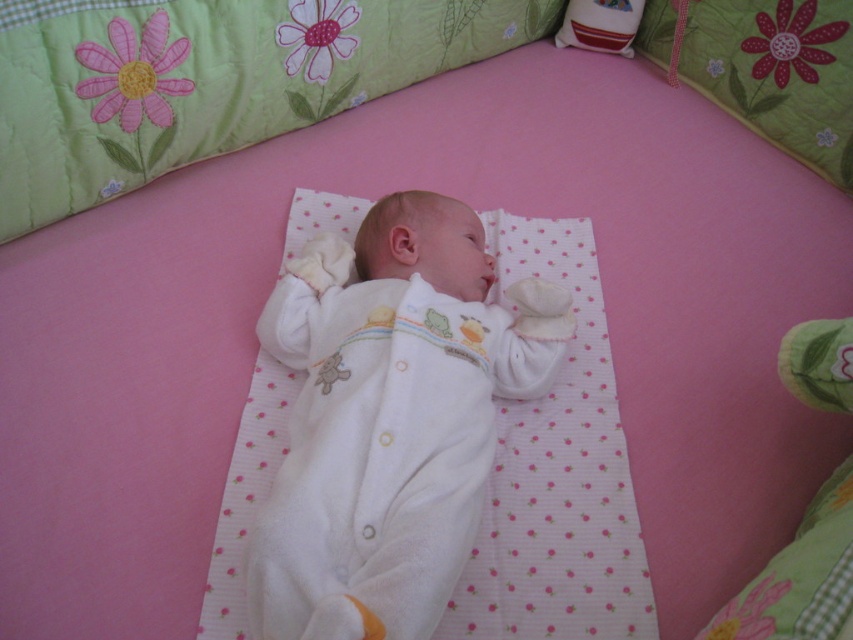
Can you confirm if white soft fabric newborn at center is wider than green quilted pillow at upper center?

Yes.

Does white soft fabric newborn at center have a larger size compared to green quilted pillow at upper center?

Indeed, white soft fabric newborn at center has a larger size compared to green quilted pillow at upper center.

Image resolution: width=853 pixels, height=640 pixels. In order to click on white soft fabric newborn at center in this screenshot , I will do `click(389, 419)`.

I want to click on white soft fabric newborn at center, so click(389, 419).

Is green quilted pillow at upper center to the left of velvety white pillow at upper right from the viewer's perspective?

Incorrect, green quilted pillow at upper center is not on the left side of velvety white pillow at upper right.

Between point (822, 83) and point (602, 28), which one is positioned in front?

Point (822, 83) is more forward.

Locate an element on the screen. The height and width of the screenshot is (640, 853). green quilted pillow at upper center is located at coordinates (766, 68).

Is white soft fabric newborn at center to the right of velvety white pillow at upper right from the viewer's perspective?

No, white soft fabric newborn at center is not to the right of velvety white pillow at upper right.

Is white soft fabric newborn at center closer to camera compared to velvety white pillow at upper right?

Yes, it is.

Image resolution: width=853 pixels, height=640 pixels. Identify the location of white soft fabric newborn at center. (389, 419).